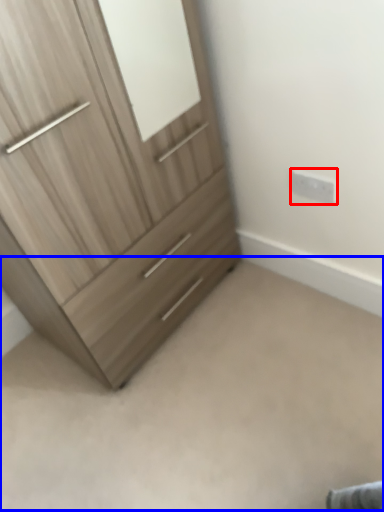
Question: Which object is further to the camera taking this photo, electric outlet (highlighted by a red box) or plain (highlighted by a blue box)?

Choices:
 (A) electric outlet
 (B) plain

Answer: (A)